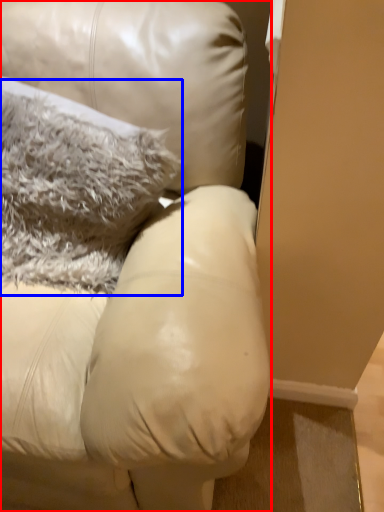
Question: Among these objects, which one is farthest to the camera, furniture (highlighted by a red box) or pillow (highlighted by a blue box)?

Choices:
 (A) furniture
 (B) pillow

Answer: (B)